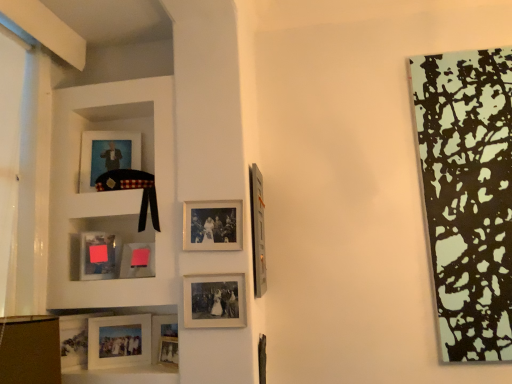
Question: From the image's perspective, does matte silver picture frame at center, the 2th picture frame in the right-to-left sequence, appear higher than matte black picture frame at upper left, acting as the ninth picture frame starting from the right?

Choices:
 (A) no
 (B) yes

Answer: (A)

Question: Would you say matte silver picture frame at center, the 2th picture frame in the right-to-left sequence, is a long distance from matte black picture frame at upper left, acting as the ninth picture frame starting from the right?

Choices:
 (A) no
 (B) yes

Answer: (A)

Question: Would you say matte silver picture frame at center, the 9th picture frame when ordered from left to right, is outside matte black picture frame at upper left, acting as the ninth picture frame starting from the right?

Choices:
 (A) no
 (B) yes

Answer: (B)

Question: Does matte silver picture frame at center, the 2th picture frame in the right-to-left sequence, have a larger size compared to matte black picture frame at upper left, arranged as the second picture frame when viewed from the left?

Choices:
 (A) yes
 (B) no

Answer: (B)

Question: From the image's perspective, is matte silver picture frame at center, the 9th picture frame when ordered from left to right, below matte black picture frame at upper left, arranged as the second picture frame when viewed from the left?

Choices:
 (A) no
 (B) yes

Answer: (B)

Question: Does matte silver picture frame at center, the 9th picture frame when ordered from left to right, have a greater width compared to matte black picture frame at upper left, arranged as the second picture frame when viewed from the left?

Choices:
 (A) yes
 (B) no

Answer: (B)

Question: Is metallic silver picture frame at upper right, the tenth picture frame in the left-to-right sequence, at the right side of matte silver picture frame at lower left, acting as the tenth picture frame starting from the right?

Choices:
 (A) yes
 (B) no

Answer: (A)

Question: Is metallic silver picture frame at upper right, the first picture frame from the right, next to matte silver picture frame at lower left, the first picture frame when ordered from left to right?

Choices:
 (A) yes
 (B) no

Answer: (B)

Question: Can you confirm if metallic silver picture frame at upper right, the first picture frame from the right, is smaller than matte silver picture frame at lower left, acting as the tenth picture frame starting from the right?

Choices:
 (A) yes
 (B) no

Answer: (B)

Question: Does metallic silver picture frame at upper right, the first picture frame from the right, come behind matte silver picture frame at lower left, the first picture frame when ordered from left to right?

Choices:
 (A) yes
 (B) no

Answer: (B)

Question: Considering the relative sizes of metallic silver picture frame at upper right, the first picture frame from the right, and matte silver picture frame at lower left, acting as the tenth picture frame starting from the right, in the image provided, is metallic silver picture frame at upper right, the first picture frame from the right, thinner than matte silver picture frame at lower left, acting as the tenth picture frame starting from the right,?

Choices:
 (A) no
 (B) yes

Answer: (B)

Question: Considering the relative sizes of metallic silver picture frame at upper right, the first picture frame from the right, and matte silver picture frame at lower left, acting as the tenth picture frame starting from the right, in the image provided, is metallic silver picture frame at upper right, the first picture frame from the right, shorter than matte silver picture frame at lower left, acting as the tenth picture frame starting from the right,?

Choices:
 (A) yes
 (B) no

Answer: (B)

Question: Would you say matte silver picture frame at lower left, acting as the tenth picture frame starting from the right, is a long distance from matte glass picture frame at lower left, which ranks as the 3th picture frame in left-to-right order?

Choices:
 (A) yes
 (B) no

Answer: (B)